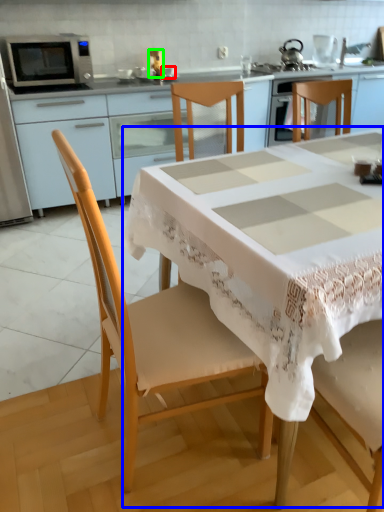
Question: Considering the real-world distances, which object is farthest from tableware (highlighted by a red box)? table (highlighted by a blue box) or appliance (highlighted by a green box)?

Choices:
 (A) table
 (B) appliance

Answer: (A)